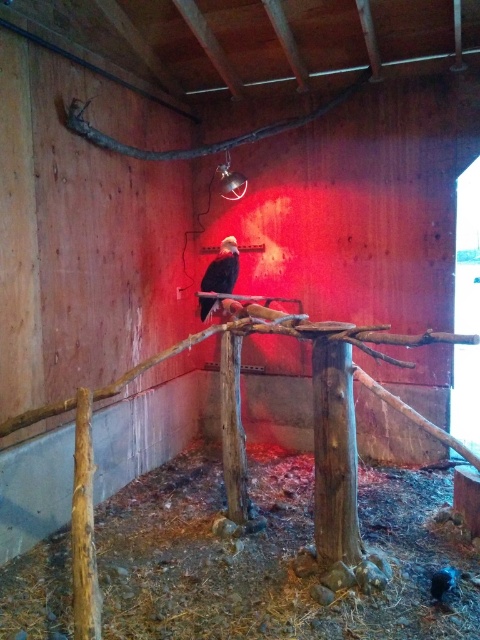
You are a zookeeper preparing to place a new perch in the enclosure. The brown rough branch at upper center and the black feathered bird at center are already present. Which object is taller and should be considered when positioning the new perch?

The brown rough branch at upper center is taller than the black feathered bird at center, so it should be considered when positioning the new perch to ensure adequate space.

You are a zookeeper preparing to feed the black feathered bird at center. You have a small container of food that needs to be placed on the brown rough branch at upper center. Can you safely place the food on the branch without disturbing the bird?

The brown rough branch at upper center is above the black feathered bird at center, so placing the food on the branch would require reaching above the bird. This might startle it, so it is not recommended to place the food there while the bird is present.